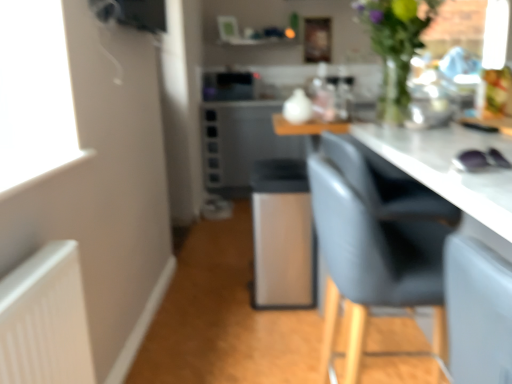
At what (x,y) coordinates should I click in order to perform the action: click on satin silver microwave at center. Please return your answer as a coordinate pair (x, y). This screenshot has height=384, width=512. Looking at the image, I should click on (229, 86).

Locate an element on the screen. Image resolution: width=512 pixels, height=384 pixels. green glass vase at upper right is located at coordinates (395, 47).

In order to click on satin silver bar stool at center in this screenshot , I will do `click(282, 235)`.

Identify the location of bar stool lying behind the green glass vase at upper right. (282, 235).

Could you tell me if satin silver bar stool at center is turned towards green glass vase at upper right?

No, satin silver bar stool at center is not turned towards green glass vase at upper right.

Choose the correct answer: Is satin silver bar stool at center inside green glass vase at upper right or outside it?

satin silver bar stool at center is not enclosed by green glass vase at upper right.

At what (x,y) coordinates should I click in order to perform the action: click on floral arrangement on the right of satin silver microwave at center. Please return your answer as a coordinate pair (x, y). This screenshot has height=384, width=512. Looking at the image, I should click on (395, 47).

Is green glass vase at upper right beside satin silver microwave at center?

No, green glass vase at upper right is not with satin silver microwave at center.

Is green glass vase at upper right taller or shorter than satin silver microwave at center?

green glass vase at upper right is taller than satin silver microwave at center.

Between green glass vase at upper right and satin silver microwave at center, which one appears on the left side from the viewer's perspective?

satin silver microwave at center.

Consider the image. What's the angular difference between satin silver microwave at center and green glass vase at upper right's facing directions?

There is a 114-degree angle between the facing directions of satin silver microwave at center and green glass vase at upper right.

Could you tell me if satin silver microwave at center is turned towards green glass vase at upper right?

Yes, satin silver microwave at center is aimed at green glass vase at upper right.

From a real-world perspective, which object rests below the other?

satin silver microwave at center is physically lower.

Considering their positions, is satin silver microwave at center located in front of or behind green glass vase at upper right?

In the image, satin silver microwave at center appears behind green glass vase at upper right.

Is matte gray chair at right in contact with satin silver microwave at center?

No.

Locate an element on the screen. This screenshot has width=512, height=384. chair below the satin silver microwave at center (from the image's perspective) is located at coordinates (374, 248).

Does matte gray chair at right have a smaller size compared to satin silver microwave at center?

Incorrect, matte gray chair at right is not smaller in size than satin silver microwave at center.

Identify the location of floral arrangement that is on the right side of satin silver bar stool at center. This screenshot has height=384, width=512. (395, 47).

Do you think green glass vase at upper right is within satin silver bar stool at center, or outside of it?

green glass vase at upper right is outside satin silver bar stool at center.

Is green glass vase at upper right taller than satin silver bar stool at center?

No, green glass vase at upper right is not taller than satin silver bar stool at center.

In the scene shown: Can you confirm if green glass vase at upper right is bigger than satin silver bar stool at center?

No.

Is satin silver microwave at center beside satin silver bar stool at center?

satin silver microwave at center and satin silver bar stool at center are clearly separated.

Is satin silver microwave at center to the left or to the right of satin silver bar stool at center in the image?

Clearly, satin silver microwave at center is on the left of satin silver bar stool at center in the image.

Is satin silver microwave at center located outside satin silver bar stool at center?

satin silver microwave at center lies outside satin silver bar stool at center's area.

From the image's perspective, would you say satin silver microwave at center is positioned over satin silver bar stool at center?

Indeed, from the image's perspective, satin silver microwave at center is shown above satin silver bar stool at center.

Which of these two, satin silver bar stool at center or matte gray chair at right, is wider?

With larger width is matte gray chair at right.

Does satin silver bar stool at center turn towards matte gray chair at right?

No.

Is satin silver bar stool at center next to matte gray chair at right?

satin silver bar stool at center and matte gray chair at right are not in contact.

Considering the relative sizes of satin silver bar stool at center and matte gray chair at right in the image provided, is satin silver bar stool at center smaller than matte gray chair at right?

Yes, satin silver bar stool at center is smaller than matte gray chair at right.

The width and height of the screenshot is (512, 384). I want to click on floral arrangement on the right of satin silver bar stool at center, so click(x=395, y=47).

Find the location of a particular element. Image resolution: width=512 pixels, height=384 pixels. appliance below the green glass vase at upper right (from a real-world perspective) is located at coordinates (229, 86).

Estimate the real-world distances between objects in this image. Which object is closer to satin silver bar stool at center, satin silver microwave at center or green glass vase at upper right?

The object closer to satin silver bar stool at center is green glass vase at upper right.

Considering their positions, is satin silver microwave at center positioned closer to green glass vase at upper right than satin silver bar stool at center?

satin silver bar stool at center is positioned closer to the anchor green glass vase at upper right.

Consider the image. Looking at the image, which one is located closer to matte gray chair at right, green glass vase at upper right or satin silver bar stool at center?

Based on the image, green glass vase at upper right appears to be nearer to matte gray chair at right.

Based on their spatial positions, is satin silver microwave at center or matte gray chair at right closer to satin silver bar stool at center?

matte gray chair at right lies closer to satin silver bar stool at center than the other object.

Estimate the real-world distances between objects in this image. Which object is closer to matte gray chair at right, satin silver bar stool at center or green glass vase at upper right?

green glass vase at upper right lies closer to matte gray chair at right than the other object.

Which object lies nearer to the anchor point satin silver bar stool at center, green glass vase at upper right or satin silver microwave at center?

green glass vase at upper right is positioned closer to the anchor satin silver bar stool at center.

Looking at this image, when comparing their distances from green glass vase at upper right, does matte gray chair at right or satin silver bar stool at center seem closer?

The object closer to green glass vase at upper right is matte gray chair at right.

Looking at the image, which one is located further to satin silver bar stool at center, green glass vase at upper right or matte gray chair at right?

green glass vase at upper right is further to satin silver bar stool at center.

At what (x,y) coordinates should I click in order to perform the action: click on bar stool located between green glass vase at upper right and satin silver microwave at center in the depth direction. Please return your answer as a coordinate pair (x, y). The image size is (512, 384). Looking at the image, I should click on (282, 235).

Identify the location of floral arrangement between matte gray chair at right and satin silver microwave at center from front to back. This screenshot has width=512, height=384. (395, 47).

Locate an element on the screen. Image resolution: width=512 pixels, height=384 pixels. floral arrangement positioned between matte gray chair at right and satin silver bar stool at center from near to far is located at coordinates (395, 47).

Locate an element on the screen. bar stool between matte gray chair at right and satin silver microwave at center along the z-axis is located at coordinates (282, 235).